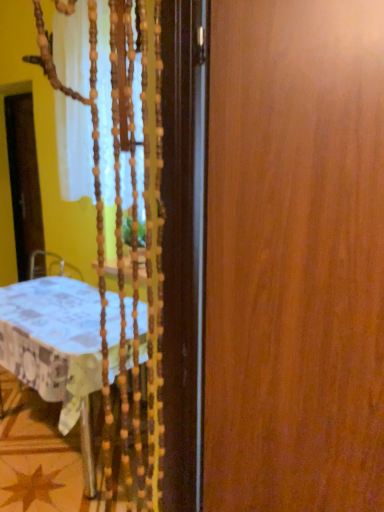
Question: Does transparent plastic screen door at left have a lesser width compared to white fabric tablecloth at left?

Choices:
 (A) no
 (B) yes

Answer: (B)

Question: Can you confirm if transparent plastic screen door at left is shorter than white fabric tablecloth at left?

Choices:
 (A) yes
 (B) no

Answer: (B)

Question: Is white fabric tablecloth at left inside transparent plastic screen door at left?

Choices:
 (A) yes
 (B) no

Answer: (B)

Question: Is the position of transparent plastic screen door at left less distant than that of white fabric tablecloth at left?

Choices:
 (A) yes
 (B) no

Answer: (B)

Question: Is transparent plastic screen door at left in contact with white fabric tablecloth at left?

Choices:
 (A) no
 (B) yes

Answer: (A)

Question: Is transparent plastic screen door at left looking in the opposite direction of white fabric tablecloth at left?

Choices:
 (A) yes
 (B) no

Answer: (B)

Question: Is white fabric tablecloth at left thinner than transparent plastic screen door at left?

Choices:
 (A) yes
 (B) no

Answer: (B)

Question: Does white fabric tablecloth at left appear on the right side of transparent plastic screen door at left?

Choices:
 (A) no
 (B) yes

Answer: (B)

Question: Considering the relative sizes of white fabric tablecloth at left and transparent plastic screen door at left in the image provided, is white fabric tablecloth at left shorter than transparent plastic screen door at left?

Choices:
 (A) no
 (B) yes

Answer: (B)

Question: Could transparent plastic screen door at left be considered to be inside white fabric tablecloth at left?

Choices:
 (A) yes
 (B) no

Answer: (B)

Question: From a real-world perspective, is white fabric tablecloth at left over transparent plastic screen door at left?

Choices:
 (A) yes
 (B) no

Answer: (B)

Question: Is white fabric tablecloth at left located outside transparent plastic screen door at left?

Choices:
 (A) no
 (B) yes

Answer: (B)

Question: From the image's perspective, is wooden door at right located above white fabric tablecloth at left?

Choices:
 (A) no
 (B) yes

Answer: (B)